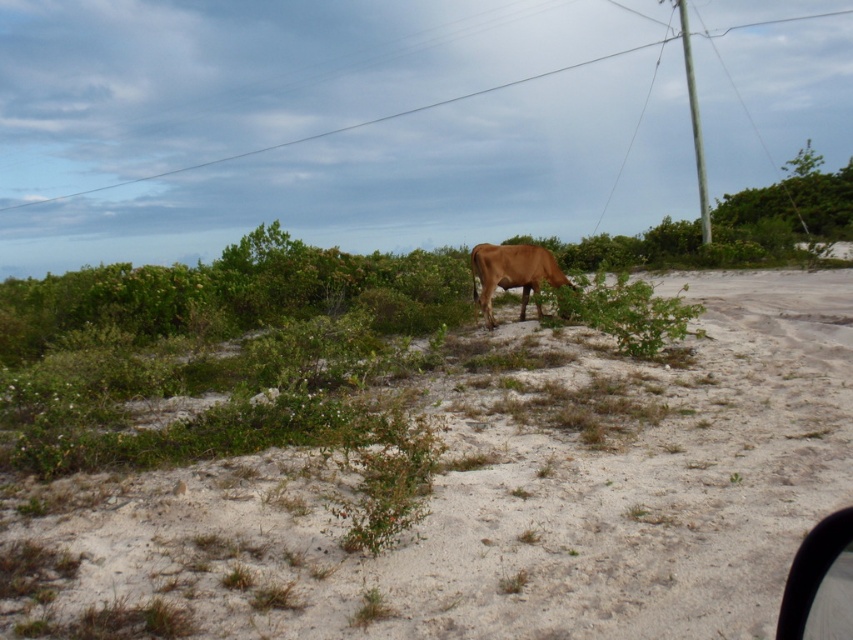
Question: Is brown sandy soil at center smaller than smooth wire at upper center?

Choices:
 (A) no
 (B) yes

Answer: (B)

Question: Which point is closer to the camera?

Choices:
 (A) smooth wire at upper center
 (B) green leafy plant at center

Answer: (B)

Question: Estimate the real-world distances between objects in this image. Which object is closer to the green leafy plant at center?

Choices:
 (A) brown matte cow at center
 (B) smooth wire at upper center

Answer: (A)

Question: Is brown sandy soil at center further to camera compared to brown matte cow at center?

Choices:
 (A) yes
 (B) no

Answer: (B)

Question: Which point appears farthest from the camera in this image?

Choices:
 (A) (477, 369)
 (B) (541, 310)
 (C) (625, 285)
 (D) (819, 572)

Answer: (B)

Question: Does green leafy plant at center have a larger size compared to smooth wire at upper center?

Choices:
 (A) yes
 (B) no

Answer: (B)